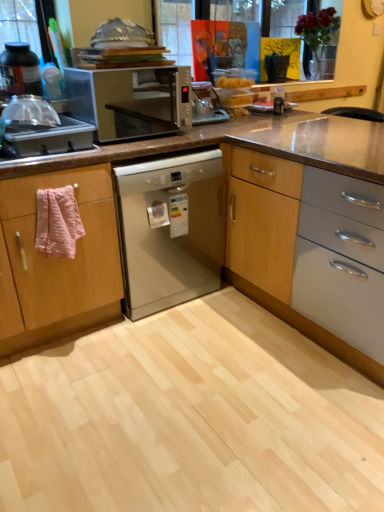
You are a GUI agent. You are given a task and a screenshot of the screen. Output one action in this format:
    pyautogui.click(x=<x>, y=<y>)
    Task: Click on the matte black bottle at left, which is the 2th kitchen appliance from bottom to top
    
    Given the screenshot: What is the action you would take?
    pyautogui.click(x=20, y=69)

You are a GUI agent. You are given a task and a screenshot of the screen. Output one action in this format:
    pyautogui.click(x=<x>, y=<y>)
    Task: Click on the pink fabric towel at left
    This screenshot has height=512, width=384.
    Given the screenshot: What is the action you would take?
    pyautogui.click(x=54, y=187)

Describe the element at coordinates (131, 101) in the screenshot. The width and height of the screenshot is (384, 512). I see `metallic silver microwave at center` at that location.

The height and width of the screenshot is (512, 384). I want to click on satin silver dishwasher at center, so click(169, 230).

This screenshot has height=512, width=384. I want to click on wooden cabinet at center, so click(x=277, y=250).

This screenshot has height=512, width=384. What do you see at coordinates (277, 250) in the screenshot?
I see `wooden cabinet at center` at bounding box center [277, 250].

You are a GUI agent. You are given a task and a screenshot of the screen. Output one action in this format:
    pyautogui.click(x=<x>, y=<y>)
    Task: Click on the matte black bottle at left, which is the 2th kitchen appliance from bottom to top
    The image size is (384, 512).
    Given the screenshot: What is the action you would take?
    pyautogui.click(x=20, y=69)

Can you confirm if pink fabric towel at left is bigger than wooden cabinet at center?

Incorrect, pink fabric towel at left is not larger than wooden cabinet at center.

Based on their positions, is pink fabric towel at left located to the left or right of wooden cabinet at center?

Based on their positions, pink fabric towel at left is located to the left of wooden cabinet at center.

Can you tell me how much pink fabric towel at left and wooden cabinet at center differ in facing direction?

The angle between the facing direction of pink fabric towel at left and the facing direction of wooden cabinet at center is 90.5 degrees.

Which point is more forward, (46, 176) or (284, 173)?

Positioned in front is point (46, 176).

Which is more to the left, metallic silver microwave at center or pink textured towel at left?

pink textured towel at left is more to the left.

From the image's perspective, is metallic silver microwave at center located above pink textured towel at left?

Yes, from the image's perspective, metallic silver microwave at center is above pink textured towel at left.

In terms of width, does metallic silver microwave at center look wider or thinner when compared to pink textured towel at left?

Considering their sizes, metallic silver microwave at center looks broader than pink textured towel at left.

Does satin silver dishwasher at center turn towards pink textured towel at left?

No, satin silver dishwasher at center is not oriented towards pink textured towel at left.

Consider the image. Can you confirm if satin silver dishwasher at center is positioned to the left of pink textured towel at left?

Incorrect, satin silver dishwasher at center is not on the left side of pink textured towel at left.

Can you see satin silver dishwasher at center touching pink textured towel at left?

A: satin silver dishwasher at center and pink textured towel at left are clearly separated.

Is satin silver dishwasher at center inside the boundaries of pink textured towel at left, or outside?

satin silver dishwasher at center is outside pink textured towel at left.

Does wooden cabinet at center have a greater height compared to pink textured towel at left?

Correct, wooden cabinet at center is much taller as pink textured towel at left.

Is wooden cabinet at center at the left side of pink textured towel at left?

In fact, wooden cabinet at center is to the right of pink textured towel at left.

Can you tell me how much wooden cabinet at center and pink textured towel at left differ in facing direction?

87.3 degrees.

Could you tell me if brushed metal sink at left, positioned as the 1th kitchen appliance in bottom-to-top order, is facing wooden cabinet at center?

No.

Is brushed metal sink at left, positioned as the 1th kitchen appliance in bottom-to-top order, wider than wooden cabinet at center?

In fact, brushed metal sink at left, positioned as the 1th kitchen appliance in bottom-to-top order, might be narrower than wooden cabinet at center.

In the scene shown: Considering the relative positions of brushed metal sink at left, the second kitchen appliance positioned from the top, and wooden cabinet at center in the image provided, is brushed metal sink at left, the second kitchen appliance positioned from the top, to the left or to the right of wooden cabinet at center?

brushed metal sink at left, the second kitchen appliance positioned from the top, is to the left of wooden cabinet at center.

I want to click on cloth on the left of metallic silver microwave at center, so click(x=58, y=222).

Is pink textured towel at left to the right of metallic silver microwave at center from the viewer's perspective?

No.

Which of these two, pink textured towel at left or metallic silver microwave at center, stands taller?

Standing taller between the two is metallic silver microwave at center.

Is pink textured towel at left facing towards metallic silver microwave at center?

No, pink textured towel at left is not aimed at metallic silver microwave at center.

Is pink fabric towel at left oriented towards satin silver dishwasher at center?

No, pink fabric towel at left does not turn towards satin silver dishwasher at center.

Is point (97, 196) farther from camera compared to point (163, 176)?

No, it is not.

Does pink fabric towel at left have a lesser width compared to satin silver dishwasher at center?

Yes, pink fabric towel at left is thinner than satin silver dishwasher at center.

This screenshot has height=512, width=384. Find the location of `drawer behind the wooden cabinet at center`. drawer behind the wooden cabinet at center is located at coordinates (54, 187).

Find the location of a particular element. cloth located underneath the metallic silver microwave at center (from a real-world perspective) is located at coordinates (58, 222).

From the image, which object appears to be farther from satin silver dishwasher at center, pink textured towel at left or pink fabric towel at left?

The object further to satin silver dishwasher at center is pink textured towel at left.

Estimate the real-world distances between objects in this image. Which object is closer to metallic silver microwave at center, satin silver dishwasher at center or wooden cabinet at center?

satin silver dishwasher at center.

Looking at the image, which one is located further to brushed metal sink at left, the second kitchen appliance positioned from the top, satin silver dishwasher at center or wooden cabinet at center?

wooden cabinet at center is positioned further to the anchor brushed metal sink at left, the second kitchen appliance positioned from the top.

Which object lies further to the anchor point pink textured towel at left, satin silver dishwasher at center or metallic silver microwave at center?

Among the two, metallic silver microwave at center is located further to pink textured towel at left.

When comparing their distances from brushed metal sink at left, the second kitchen appliance positioned from the top, does pink fabric towel at left or matte black bottle at left, which is the 2th kitchen appliance from bottom to top, seem further?

The object further to brushed metal sink at left, the second kitchen appliance positioned from the top, is matte black bottle at left, which is the 2th kitchen appliance from bottom to top.

Which object lies nearer to the anchor point pink textured towel at left, matte black bottle at left, which is the 2th kitchen appliance from bottom to top, or satin silver dishwasher at center?

satin silver dishwasher at center lies closer to pink textured towel at left than the other object.

Based on their spatial positions, is matte black bottle at left, which is the 2th kitchen appliance from bottom to top, or pink fabric towel at left further from metallic silver microwave at center?

pink fabric towel at left is positioned further to the anchor metallic silver microwave at center.

Which object lies further to the anchor point wooden cabinet at center, matte black bottle at left, marked as the first kitchen appliance in a top-to-bottom arrangement, or satin silver dishwasher at center?

Based on the image, matte black bottle at left, marked as the first kitchen appliance in a top-to-bottom arrangement, appears to be further to wooden cabinet at center.

The width and height of the screenshot is (384, 512). What are the coordinates of `kitchen appliance between pink fabric towel at left and metallic silver microwave at center` in the screenshot? It's located at (47, 138).

At what (x,y) coordinates should I click in order to perform the action: click on home appliance between matte black bottle at left, marked as the first kitchen appliance in a top-to-bottom arrangement, and pink textured towel at left vertically. Please return your answer as a coordinate pair (x, y). This screenshot has height=512, width=384. Looking at the image, I should click on tap(169, 230).

Where is `cloth situated between pink fabric towel at left and wooden cabinet at center from left to right`? cloth situated between pink fabric towel at left and wooden cabinet at center from left to right is located at coordinates (58, 222).

At what (x,y) coordinates should I click in order to perform the action: click on kitchen appliance that lies between matte black bottle at left, which is the 2th kitchen appliance from bottom to top, and satin silver dishwasher at center from top to bottom. Please return your answer as a coordinate pair (x, y). Looking at the image, I should click on tap(47, 138).